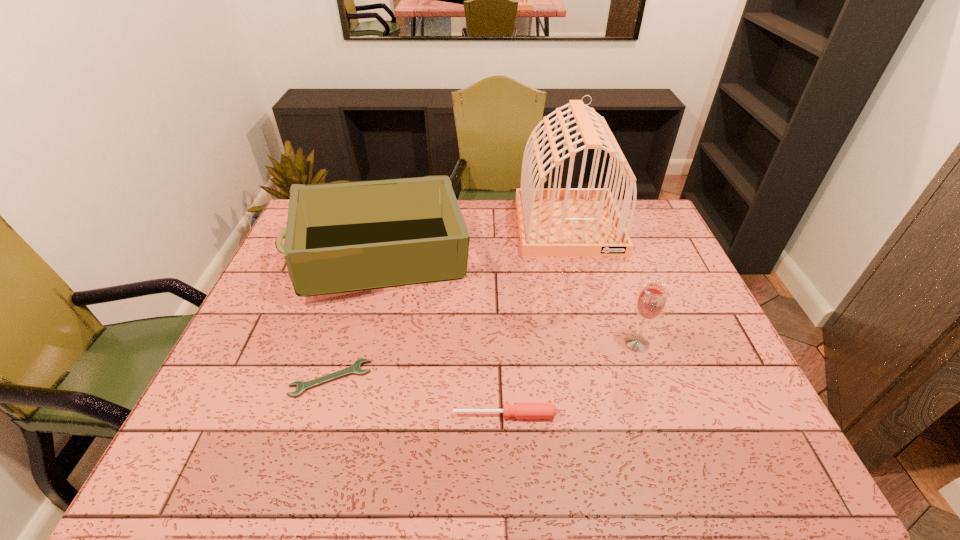
Where is `birdcage`? The height and width of the screenshot is (540, 960). birdcage is located at coordinates (553, 222).

What are the coordinates of `box` in the screenshot? It's located at (344, 236).

What are the coordinates of `wineglass` in the screenshot? It's located at click(x=651, y=301).

The image size is (960, 540). Identify the location of the nearest object. (520, 410).

You are a GUI agent. You are given a task and a screenshot of the screen. Output one action in this format:
    pyautogui.click(x=<x>, y=<y>)
    Task: Click on the screwdriver
    Image resolution: width=960 pixels, height=540 pixels.
    Given the screenshot: What is the action you would take?
    pyautogui.click(x=520, y=410)

Where is `the second nearest object`? Image resolution: width=960 pixels, height=540 pixels. the second nearest object is located at coordinates (355, 369).

At what (x,y) coordinates should I click in order to perform the action: click on wrench. Please return your answer as a coordinate pair (x, y). Looking at the image, I should click on (355, 369).

Where is `free location located 0.180m with an open door on the birdcage`? The width and height of the screenshot is (960, 540). free location located 0.180m with an open door on the birdcage is located at coordinates (587, 296).

The image size is (960, 540). Identify the location of free space located on the front of the box. (345, 411).

Locate an element on the screen. The image size is (960, 540). free space located on the left of the wineglass is located at coordinates (492, 343).